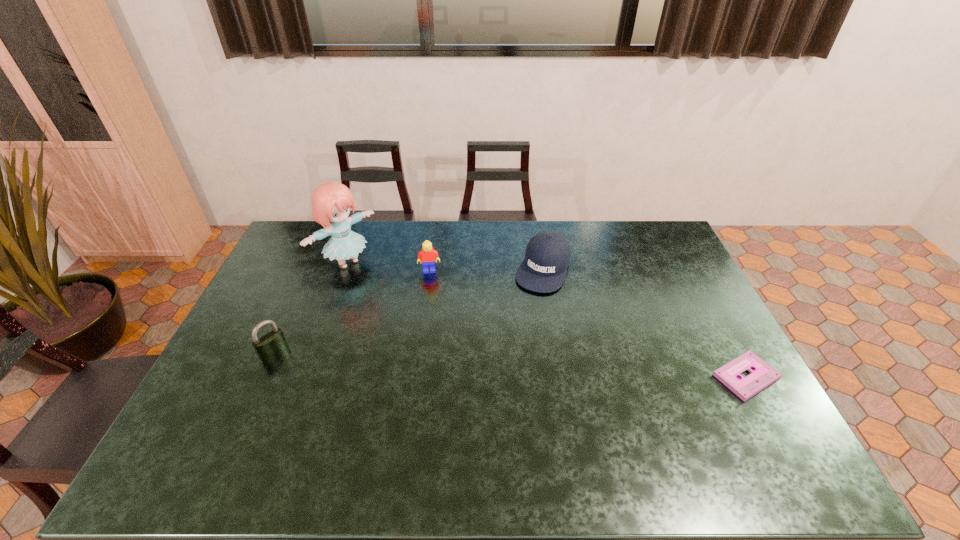
Identify the location of object located in the near edge section of the desktop. (762, 375).

What are the coordinates of `padlock situated at the left edge` in the screenshot? It's located at (272, 344).

This screenshot has height=540, width=960. What are the coordinates of `doll that is at the left edge` in the screenshot? It's located at (331, 201).

Where is `object present at the right edge`? object present at the right edge is located at coordinates (762, 375).

Find the location of a particular element. object located in the far left corner section of the desktop is located at coordinates (331, 201).

The image size is (960, 540). What are the coordinates of `object that is at the near right corner` in the screenshot? It's located at (762, 375).

Find the location of a particular element. vacant space at the far edge of the desktop is located at coordinates (493, 242).

Where is `vacant space at the left edge of the desktop`? The image size is (960, 540). vacant space at the left edge of the desktop is located at coordinates point(222,384).

In order to click on vacant space at the right edge of the desktop in this screenshot , I will do `click(715, 320)`.

In the image, there is a desktop. At what (x,y) coordinates should I click in order to perform the action: click on free space at the near left corner. Please return your answer as a coordinate pair (x, y). This screenshot has height=540, width=960. Looking at the image, I should click on 217,428.